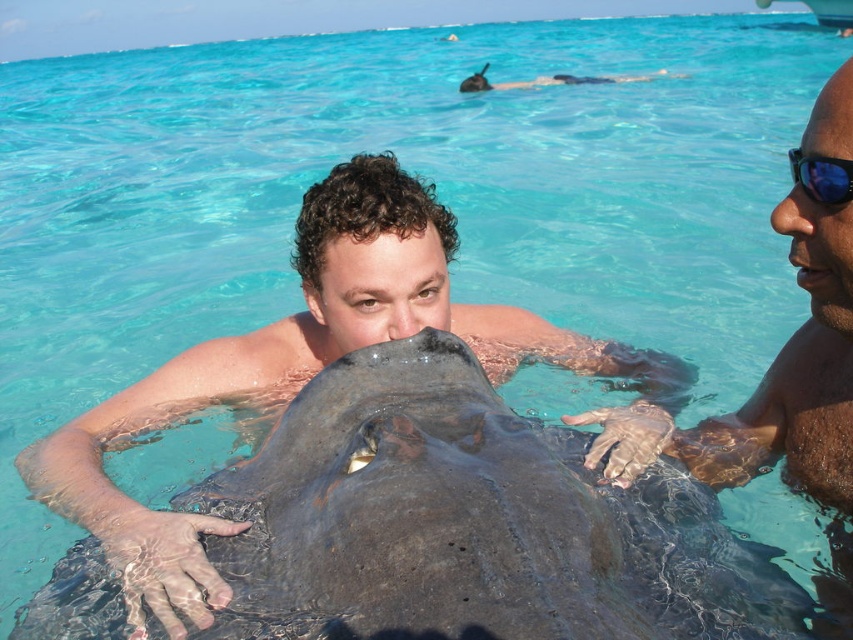
What do you see at coordinates (469, 524) in the screenshot? Image resolution: width=853 pixels, height=640 pixels. I see `smooth gray stingray at center` at bounding box center [469, 524].

Is smooth gray stingray at center positioned at the back of smooth skin man at right?

No.

Describe the element at coordinates (469, 524) in the screenshot. The width and height of the screenshot is (853, 640). I see `smooth gray stingray at center` at that location.

You are a GUI agent. You are given a task and a screenshot of the screen. Output one action in this format:
    pyautogui.click(x=<x>, y=<y>)
    Task: Click on the smooth gray stingray at center
    
    Given the screenshot: What is the action you would take?
    pyautogui.click(x=469, y=524)

Is smooth skin man at right thinner than black matte stingray at upper center?

Correct, smooth skin man at right's width is less than black matte stingray at upper center's.

Looking at this image, does smooth skin man at right have a larger size compared to black matte stingray at upper center?

No.

Does point (822, 406) come closer to viewer compared to point (544, 84)?

Yes, point (822, 406) is in front of point (544, 84).

Where is `smooth skin man at right`? This screenshot has width=853, height=640. smooth skin man at right is located at coordinates (776, 403).

Is point (723, 417) positioned behind point (820, 170)?

Yes, it is behind point (820, 170).

Which is in front, point (788, 260) or point (811, 172)?

Point (811, 172)

I want to click on smooth skin man at right, so click(x=776, y=403).